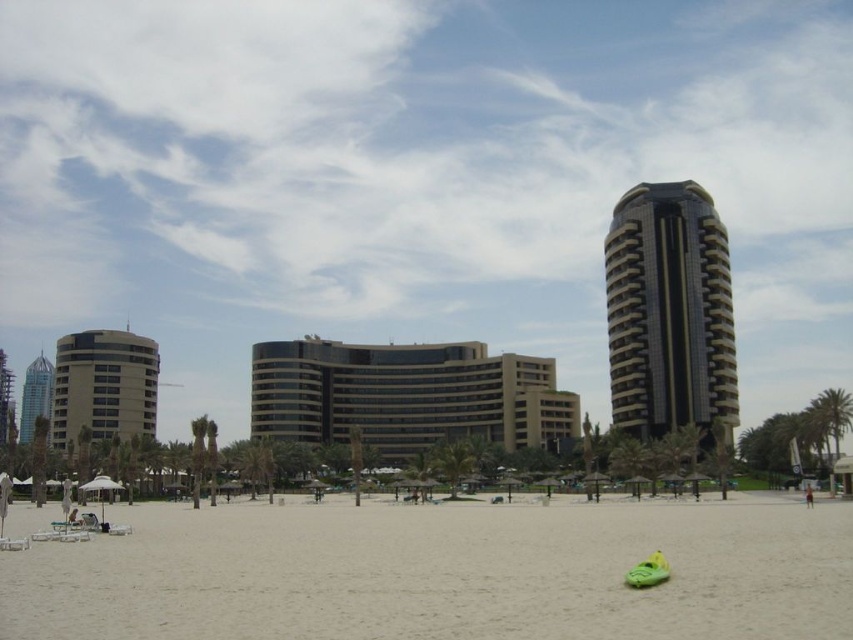
Who is more distant from viewer, (100,376) or (635,579)?

Point (100,376)

Who is more forward, (141,392) or (653,563)?

Point (653,563) is in front.

You are a GUI agent. You are given a task and a screenshot of the screen. Output one action in this format:
    pyautogui.click(x=<x>, y=<y>)
    Task: Click on the matte beige building at left
    This screenshot has height=640, width=853.
    Given the screenshot: What is the action you would take?
    pyautogui.click(x=103, y=387)

Locate an element on the screen. matte beige building at left is located at coordinates (103, 387).

Who is more forward, (265, 376) or (807, 499)?

Point (807, 499)

Can you confirm if brown glass building at center is positioned above skinny jeans at lower right?

Yes.

Describe the element at coordinates (407, 396) in the screenshot. I see `brown glass building at center` at that location.

You are a GUI agent. You are given a task and a screenshot of the screen. Output one action in this format:
    pyautogui.click(x=<x>, y=<y>)
    Task: Click on the brown glass building at center
    The width and height of the screenshot is (853, 640).
    Given the screenshot: What is the action you would take?
    pyautogui.click(x=407, y=396)

Is shiny glass skyscraper at right bigger than matte beige building at left?

Actually, shiny glass skyscraper at right might be smaller than matte beige building at left.

Which of these two, shiny glass skyscraper at right or matte beige building at left, stands taller?

Standing taller between the two is shiny glass skyscraper at right.

The image size is (853, 640). What do you see at coordinates (670, 314) in the screenshot?
I see `shiny glass skyscraper at right` at bounding box center [670, 314].

You are a GUI agent. You are given a task and a screenshot of the screen. Output one action in this format:
    pyautogui.click(x=<x>, y=<y>)
    Task: Click on the shiny glass skyscraper at right
    
    Given the screenshot: What is the action you would take?
    pyautogui.click(x=670, y=314)